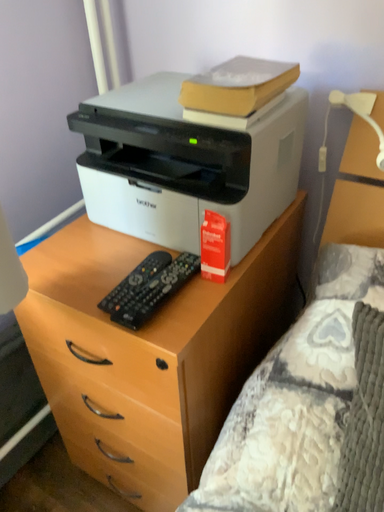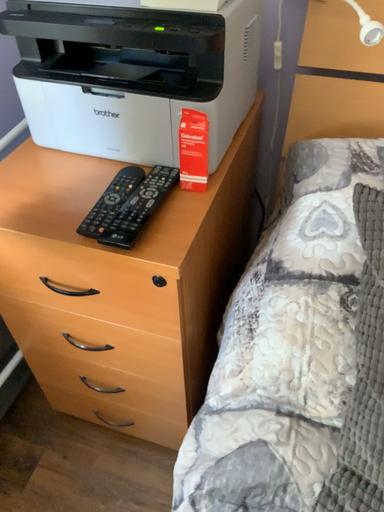
Question: How did the camera likely rotate when shooting the video?

Choices:
 (A) rotated right
 (B) rotated left

Answer: (A)